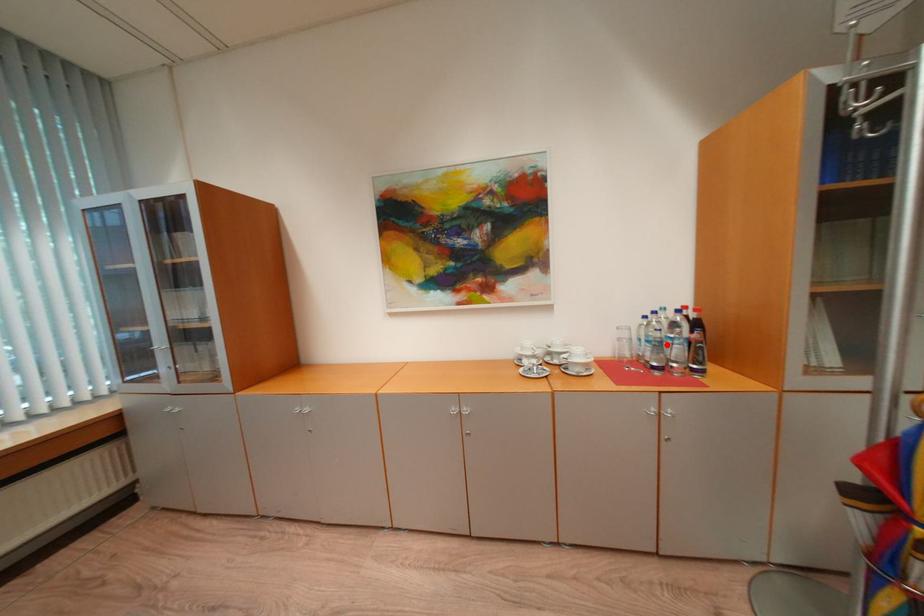
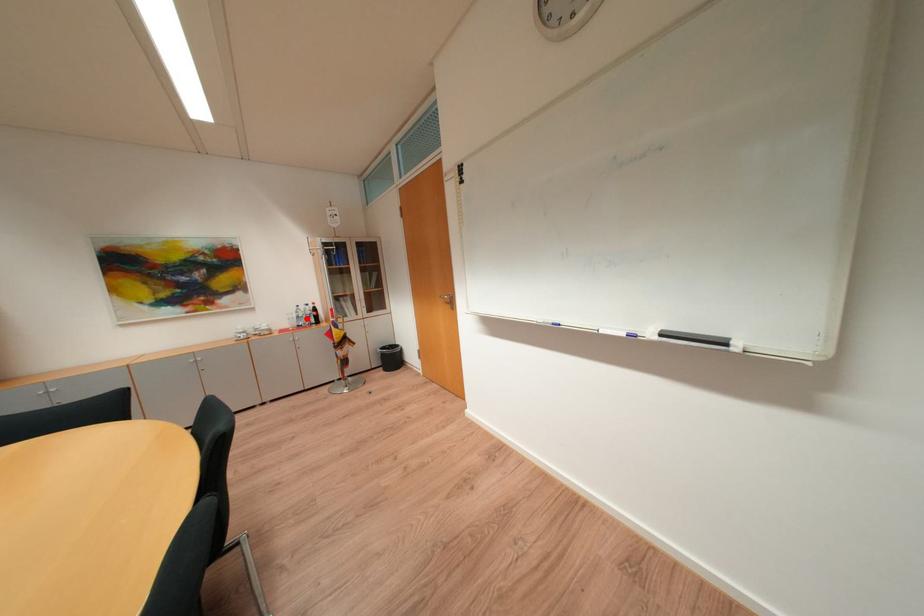
I am providing you with two images of the same scene from different viewpoints. A red point is marked on the first image and another point is marked on the second image. Does the point marked in image1 correspond to the same location as the one in image2?

Yes